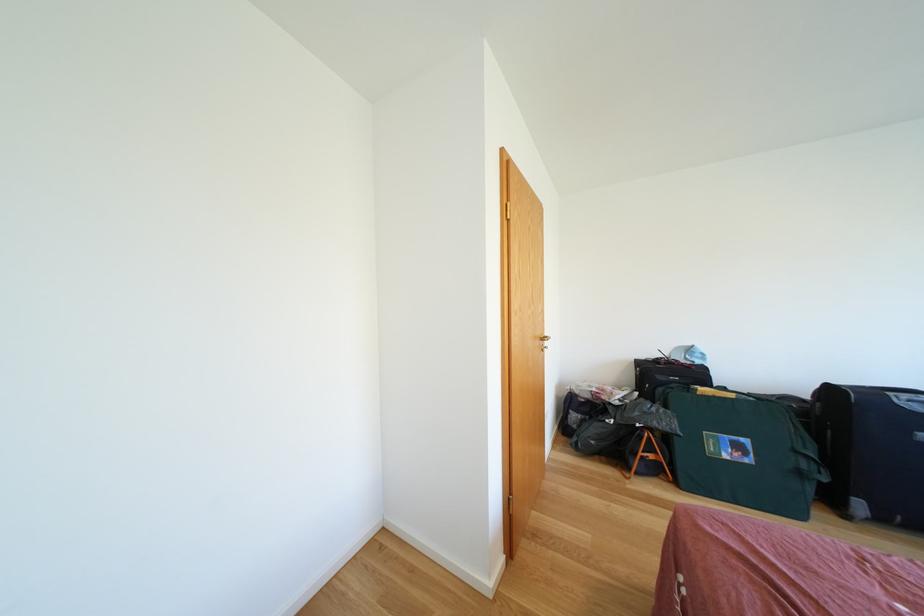
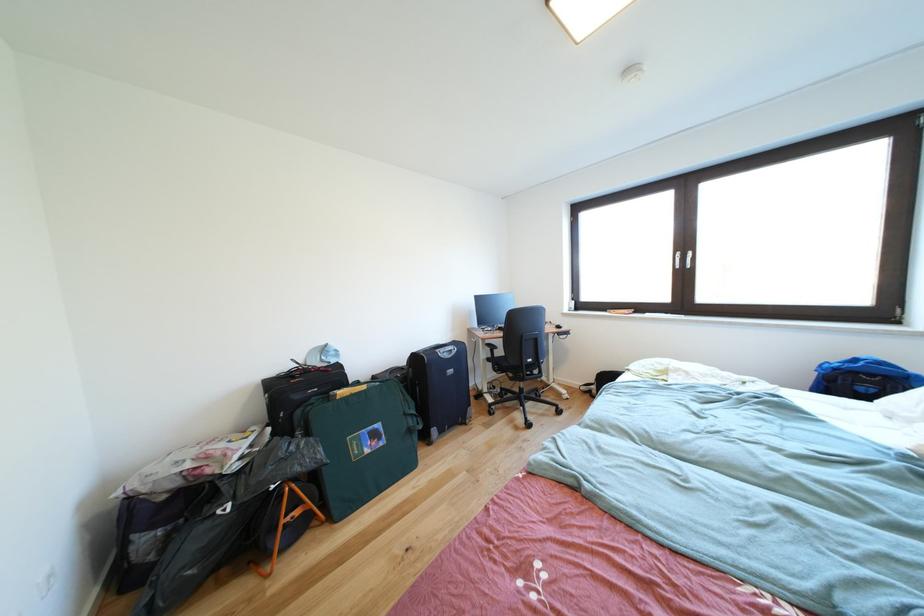
Question: Based on the continuous images, in which direction is the camera rotating? Reply with the corresponding letter.

Choices:
 (A) Left
 (B) Right
 (C) Up
 (D) Down

Answer: (B)